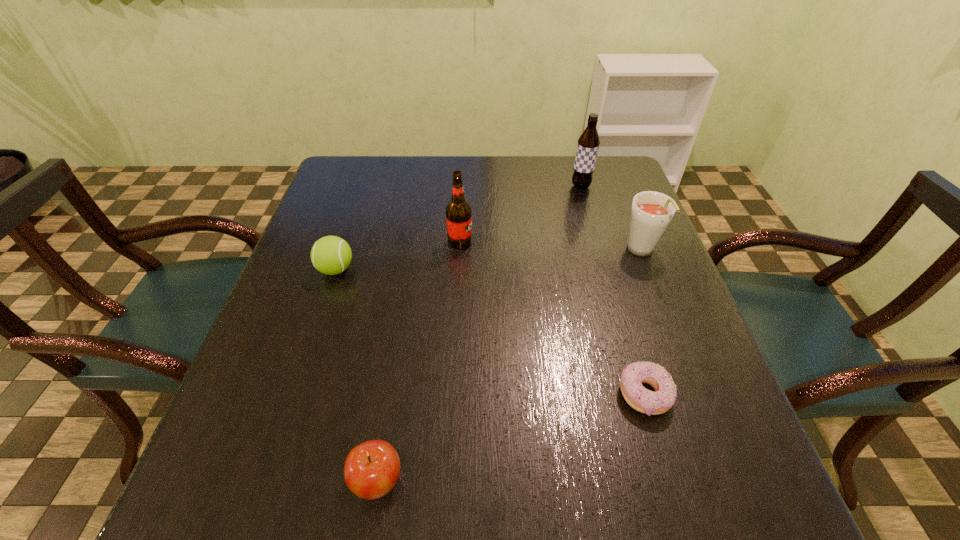
Where is `blank area located 0.220m on the left of the fourth object from right to left`? The width and height of the screenshot is (960, 540). blank area located 0.220m on the left of the fourth object from right to left is located at coordinates (359, 242).

Image resolution: width=960 pixels, height=540 pixels. Identify the location of vacant space located 0.380m on the drink side of the rightmost root beer. (708, 426).

The width and height of the screenshot is (960, 540). I want to click on free spot located on the right of the leftmost object, so click(489, 269).

The height and width of the screenshot is (540, 960). In order to click on vacant space situated on the right of the apple in this screenshot , I will do `click(577, 480)`.

Identify the location of free region located on the left of the fifth farthest object. The image size is (960, 540). (440, 395).

Image resolution: width=960 pixels, height=540 pixels. Identify the location of object that is at the far edge. (588, 144).

Locate an element on the screen. The height and width of the screenshot is (540, 960). object present at the near edge is located at coordinates (372, 468).

Image resolution: width=960 pixels, height=540 pixels. Identify the location of object located in the left edge section of the desktop. (331, 255).

In order to click on doughnut that is at the right edge in this screenshot , I will do `click(641, 399)`.

This screenshot has width=960, height=540. I want to click on object at the far right corner, so click(x=588, y=144).